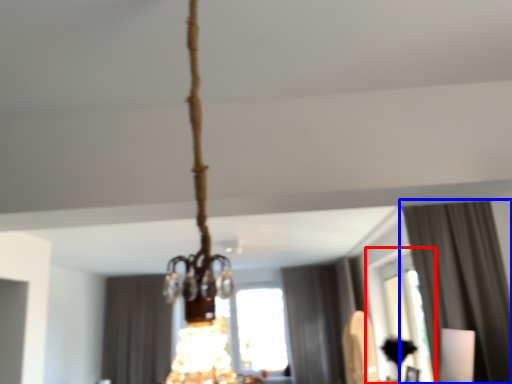
Question: Which point is further to the camera, window (highlighted by a red box) or curtain (highlighted by a blue box)?

Choices:
 (A) window
 (B) curtain

Answer: (A)